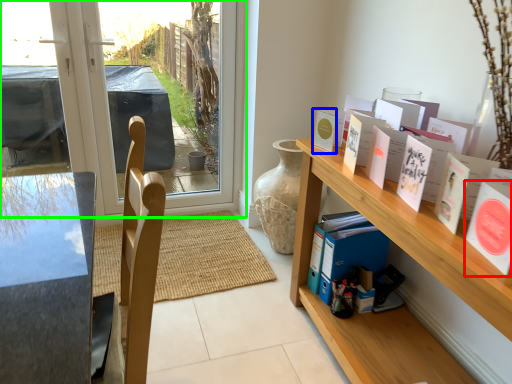
Question: Which object is the farthest from book (highlighted by a red box)? Choose among these: book (highlighted by a blue box) or window (highlighted by a green box).

Choices:
 (A) book
 (B) window

Answer: (B)